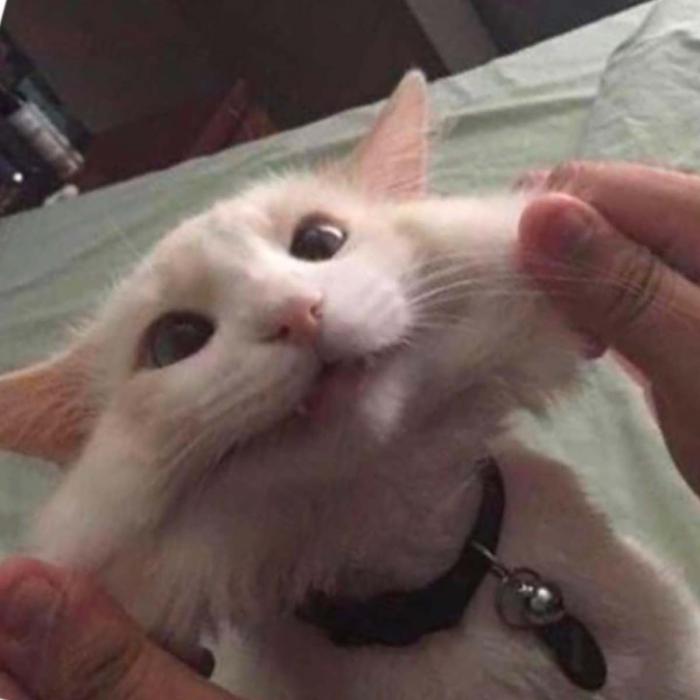
This screenshot has width=700, height=700. Identify the location of bed sheet. (80, 245).